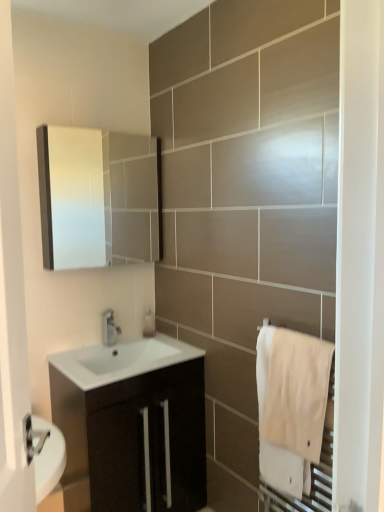
The width and height of the screenshot is (384, 512). What are the coordinates of `vacant area that is situated to the right of clear plastic soap dispenser at center` in the screenshot? It's located at (163, 340).